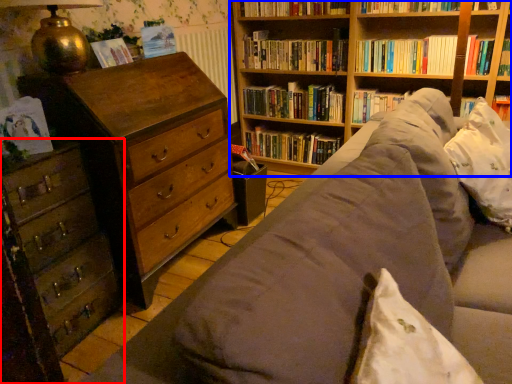
Question: Among these objects, which one is nearest to the camera, chest of drawers (highlighted by a red box) or bookcase (highlighted by a blue box)?

Choices:
 (A) chest of drawers
 (B) bookcase

Answer: (A)